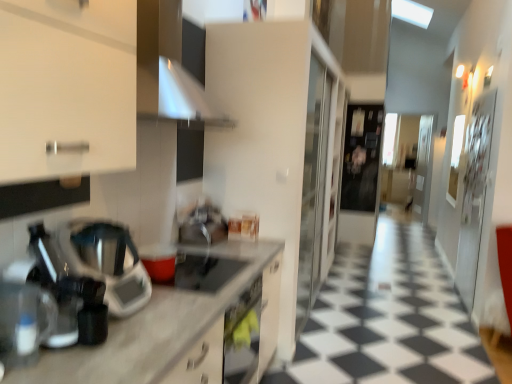
Question: Can you confirm if white marble countertop at left is taller than matte black gas stove at center?

Choices:
 (A) no
 (B) yes

Answer: (B)

Question: From the image's perspective, is white marble countertop at left on matte black gas stove at center?

Choices:
 (A) no
 (B) yes

Answer: (A)

Question: Does white marble countertop at left have a greater width compared to matte black gas stove at center?

Choices:
 (A) yes
 (B) no

Answer: (A)

Question: From the image's perspective, does white marble countertop at left appear lower than matte black gas stove at center?

Choices:
 (A) no
 (B) yes

Answer: (B)

Question: Is white marble countertop at left far from matte black gas stove at center?

Choices:
 (A) no
 (B) yes

Answer: (A)

Question: Can you confirm if white marble countertop at left is smaller than matte black gas stove at center?

Choices:
 (A) no
 (B) yes

Answer: (A)

Question: Can you confirm if transparent plastic coffee machine at left, the second coffee machine from the back, is positioned to the right of matte black gas stove at center?

Choices:
 (A) yes
 (B) no

Answer: (B)

Question: Can you confirm if transparent plastic coffee machine at left, which is counted as the 1th coffee machine, starting from the front, is bigger than matte black gas stove at center?

Choices:
 (A) yes
 (B) no

Answer: (A)

Question: Is transparent plastic coffee machine at left, the second coffee machine from the back, placed right next to matte black gas stove at center?

Choices:
 (A) yes
 (B) no

Answer: (B)

Question: Can you confirm if transparent plastic coffee machine at left, which is counted as the 1th coffee machine, starting from the front, is taller than matte black gas stove at center?

Choices:
 (A) no
 (B) yes

Answer: (B)

Question: Is transparent plastic coffee machine at left, which is counted as the 1th coffee machine, starting from the front, shorter than matte black gas stove at center?

Choices:
 (A) no
 (B) yes

Answer: (A)

Question: Does sleek metallic coffee machine at left, which ranks as the first coffee machine in back-to-front order, appear on the right side of matte black gas stove at center?

Choices:
 (A) no
 (B) yes

Answer: (A)